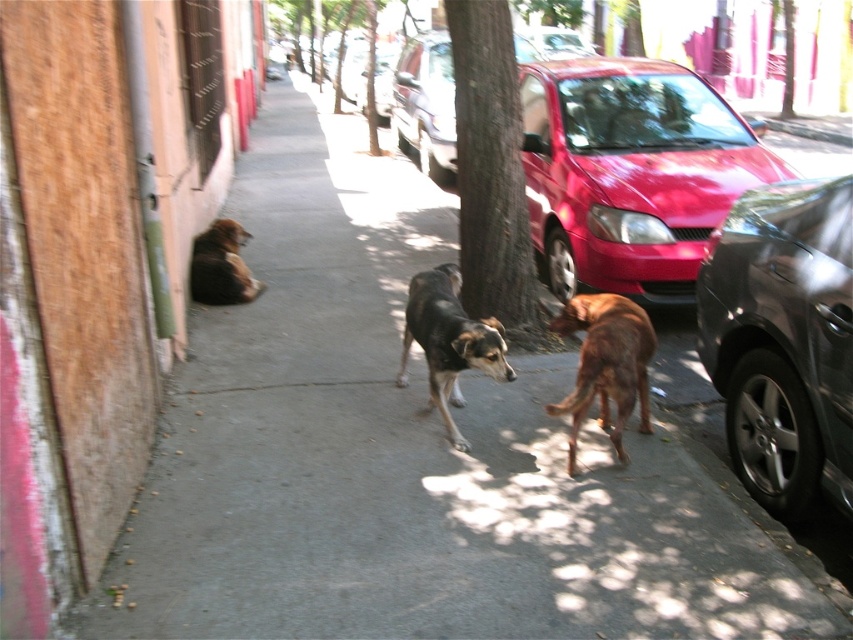
You are a pedestrian standing on the sidewalk and want to walk towards the brown furry dog at center. There is a shiny red car at right in your path. Which object will you encounter first?

You will encounter the shiny red car at right first because it is closer to you than the brown furry dog at center.

You are standing at the origin point of the coordinate system where the bottom left corner of the image is the origin. The image has a coordinate system where the x and y axes increase to the right and upwards respectively. You want to walk to the shiny red car at right. In which direction should you move first? Please answer with either left, right, up, or down.

The shiny red car at right is located at coordinate point 0.270 in the x direction and 0.741 in the y direction. Since you are at the origin where x and y are both 0, you should first move to the right along the x axis to increase your x coordinate towards 0.270. After that, you would move upwards along the y axis to reach 0.741. However, since the question asks for the first direction, the correct initial direction is right.

Looking at this image, you are standing on the sidewalk in the scene and want to take a photo of the shiny metallic car at right. Where should you position yourself to capture the car in the frame?

The shiny metallic car at right is located at point (782, 340), so you should position yourself near the sidewalk towards the lower right to capture it in the frame.